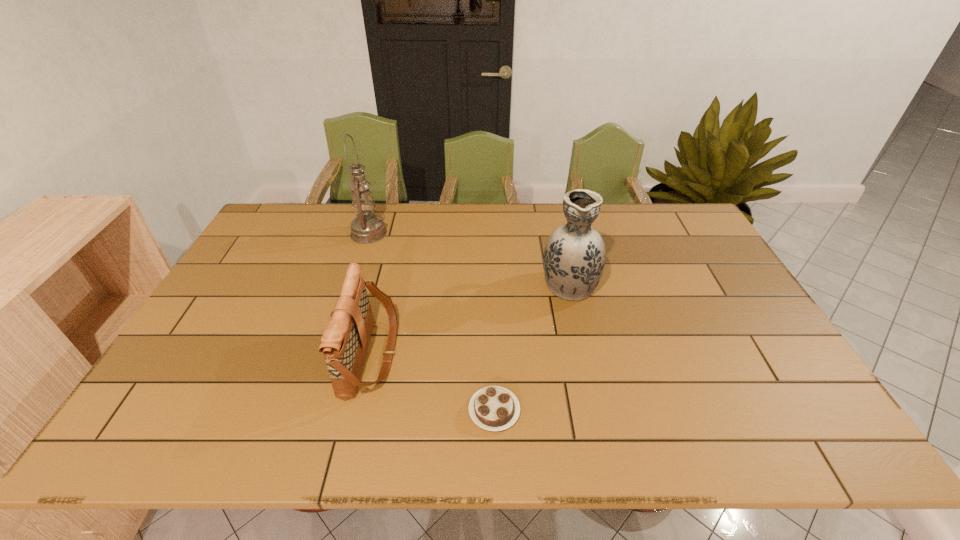
Locate an element on the screen. This screenshot has height=540, width=960. oil lamp is located at coordinates 366,228.

You are a GUI agent. You are given a task and a screenshot of the screen. Output one action in this format:
    pyautogui.click(x=<x>, y=<y>)
    Task: Click on the farthest object
    The height and width of the screenshot is (540, 960).
    Given the screenshot: What is the action you would take?
    pyautogui.click(x=366, y=228)

What are the coordinates of `vase` in the screenshot? It's located at pos(574,257).

Where is `the second farthest object`? The height and width of the screenshot is (540, 960). the second farthest object is located at coordinates (574, 257).

At what (x,y) coordinates should I click in order to perform the action: click on shoulder bag. Please return your answer as a coordinate pair (x, y). The image size is (960, 540). Looking at the image, I should click on (344, 343).

Locate an element on the screen. This screenshot has width=960, height=540. the shortest object is located at coordinates (494, 408).

Where is `the third object from left to right`? the third object from left to right is located at coordinates click(494, 408).

At what (x,y) coordinates should I click in order to perform the action: click on vacant region located on the front of the tallest object. Please return your answer as a coordinate pair (x, y). Image resolution: width=960 pixels, height=540 pixels. Looking at the image, I should click on (350, 288).

You are a GUI agent. You are given a task and a screenshot of the screen. Output one action in this format:
    pyautogui.click(x=<x>, y=<y>)
    Task: Click on the free spot located 0.280m with the handle on the side of the third shortest object
    This screenshot has width=960, height=540.
    Given the screenshot: What is the action you would take?
    (x=554, y=215)

Locate an element on the screen. blank space located 0.090m with the handle on the side of the third shortest object is located at coordinates (561, 246).